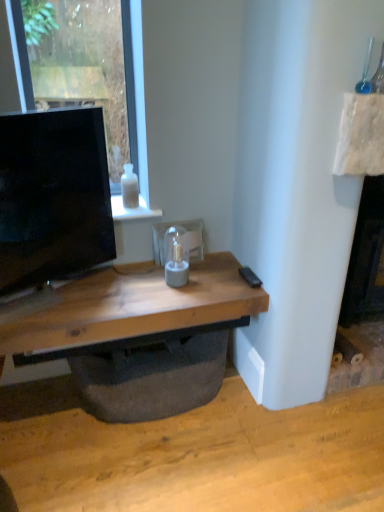
The height and width of the screenshot is (512, 384). I want to click on free space in front of black plastic remote at lower right, so click(x=238, y=293).